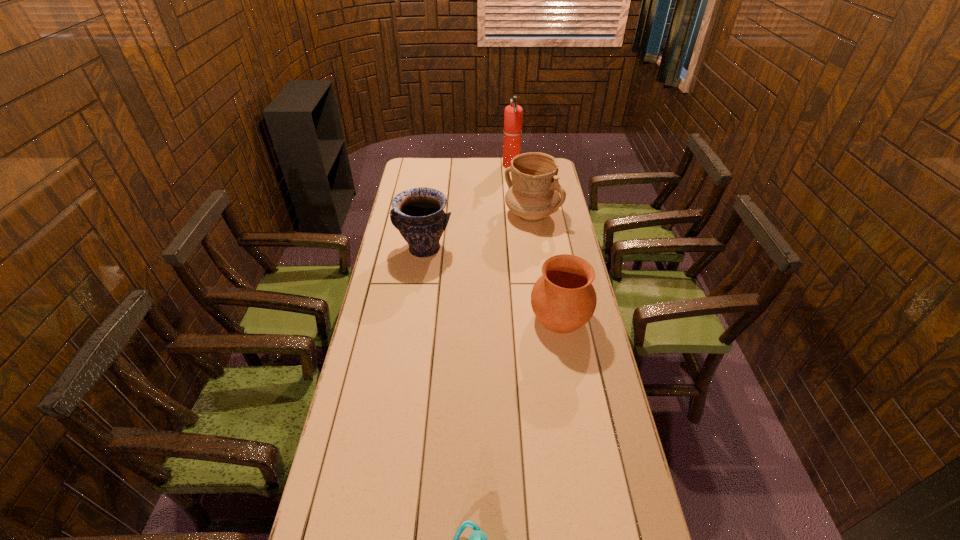
You are a GUI agent. You are given a task and a screenshot of the screen. Output one action in this format:
    pyautogui.click(x=<x>, y=<y>)
    Task: Click on the blank area in the image that satisfies the following two spatial constraints: 1. with the nozzle and gauge on the farthest object; 2. on the front handle of the leftmost pottery
    The width and height of the screenshot is (960, 540).
    Given the screenshot: What is the action you would take?
    (519, 249)

You are a GUI agent. You are given a task and a screenshot of the screen. Output one action in this format:
    pyautogui.click(x=<x>, y=<y>)
    Task: Click on the free location that satisfies the following two spatial constraints: 1. on the front side of the fourth farthest object; 2. on the right side of the farthest pottery
    Image resolution: width=960 pixels, height=540 pixels.
    Given the screenshot: What is the action you would take?
    pyautogui.click(x=546, y=318)

The image size is (960, 540). Identify the location of vacant space that satisfies the following two spatial constraints: 1. with the nozzle and gauge on the nearest pottery; 2. on the right side of the fire extinguisher. (527, 318).

The height and width of the screenshot is (540, 960). I want to click on free space in the image that satisfies the following two spatial constraints: 1. with the nozzle and gauge on the fourth farthest object; 2. on the right side of the tallest object, so click(x=527, y=318).